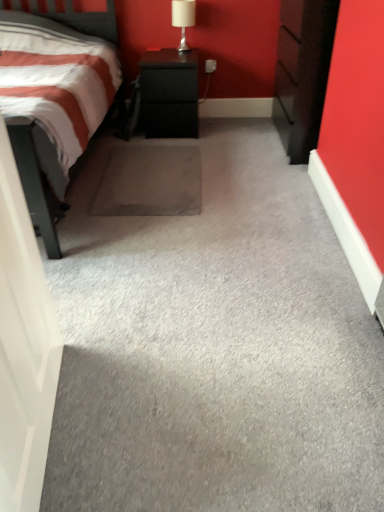
Find the location of `unoccupied region to the right of black textured cabinet at center`. unoccupied region to the right of black textured cabinet at center is located at coordinates (223, 128).